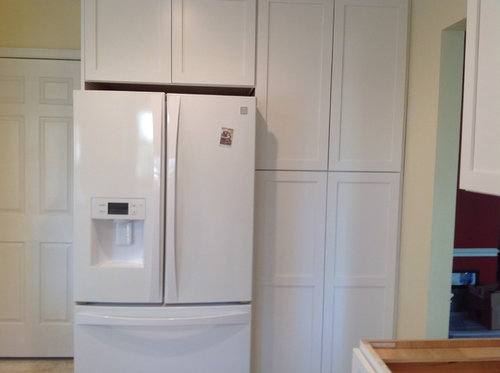
Find the location of `freezer handle`. freezer handle is located at coordinates (161, 320).